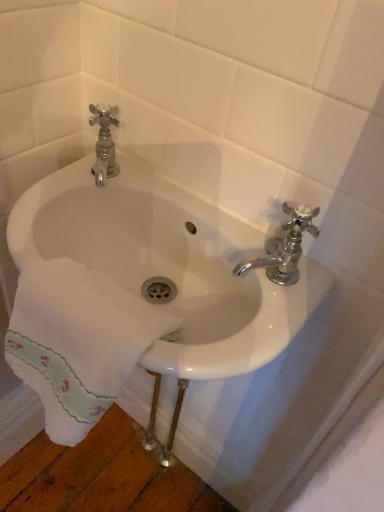
Question: Are chrome metallic faucet at upper right and white ceramic sink at center beside each other?

Choices:
 (A) no
 (B) yes

Answer: (A)

Question: From a real-world perspective, is chrome metallic faucet at upper right over white ceramic sink at center?

Choices:
 (A) yes
 (B) no

Answer: (A)

Question: Is chrome metallic faucet at upper right positioned with its back to white ceramic sink at center?

Choices:
 (A) no
 (B) yes

Answer: (A)

Question: From the image's perspective, would you say chrome metallic faucet at upper right is shown under white ceramic sink at center?

Choices:
 (A) no
 (B) yes

Answer: (A)

Question: From the image's perspective, would you say chrome metallic faucet at upper right is positioned over white ceramic sink at center?

Choices:
 (A) yes
 (B) no

Answer: (A)

Question: From their relative heights in the image, would you say white ceramic sink at center is taller or shorter than chrome metallic faucet at upper right?

Choices:
 (A) tall
 (B) short

Answer: (A)

Question: Is white ceramic sink at center inside the boundaries of chrome metallic faucet at upper right, or outside?

Choices:
 (A) inside
 (B) outside

Answer: (B)

Question: From the image's perspective, is white ceramic sink at center located above or below chrome metallic faucet at upper right?

Choices:
 (A) below
 (B) above

Answer: (A)

Question: Is white ceramic sink at center wider or thinner than chrome metallic faucet at upper right?

Choices:
 (A) thin
 (B) wide

Answer: (B)

Question: Looking at their shapes, would you say chrome metallic faucet at upper right is wider or thinner than white embroidered towel at lower left?

Choices:
 (A) thin
 (B) wide

Answer: (A)

Question: Relative to white embroidered towel at lower left, is chrome metallic faucet at upper right in front or behind?

Choices:
 (A) front
 (B) behind

Answer: (B)

Question: From their relative heights in the image, would you say chrome metallic faucet at upper right is taller or shorter than white embroidered towel at lower left?

Choices:
 (A) short
 (B) tall

Answer: (A)

Question: From the image's perspective, is chrome metallic faucet at upper right positioned above or below white embroidered towel at lower left?

Choices:
 (A) below
 (B) above

Answer: (B)

Question: In terms of size, does white ceramic sink at center appear bigger or smaller than white embroidered towel at lower left?

Choices:
 (A) big
 (B) small

Answer: (A)

Question: Is white ceramic sink at center inside or outside of white embroidered towel at lower left?

Choices:
 (A) outside
 (B) inside

Answer: (A)